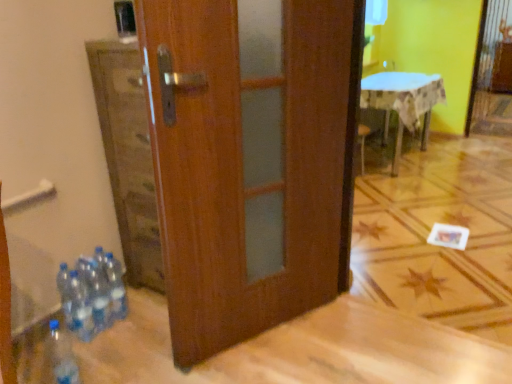
At what (x,y) coordinates should I click in order to perform the action: click on vacant space to the right of clear plastic bottles at lower left, acting as the 1th bottle starting from the back. Please return your answer as a coordinate pair (x, y). The height and width of the screenshot is (384, 512). Looking at the image, I should click on (145, 317).